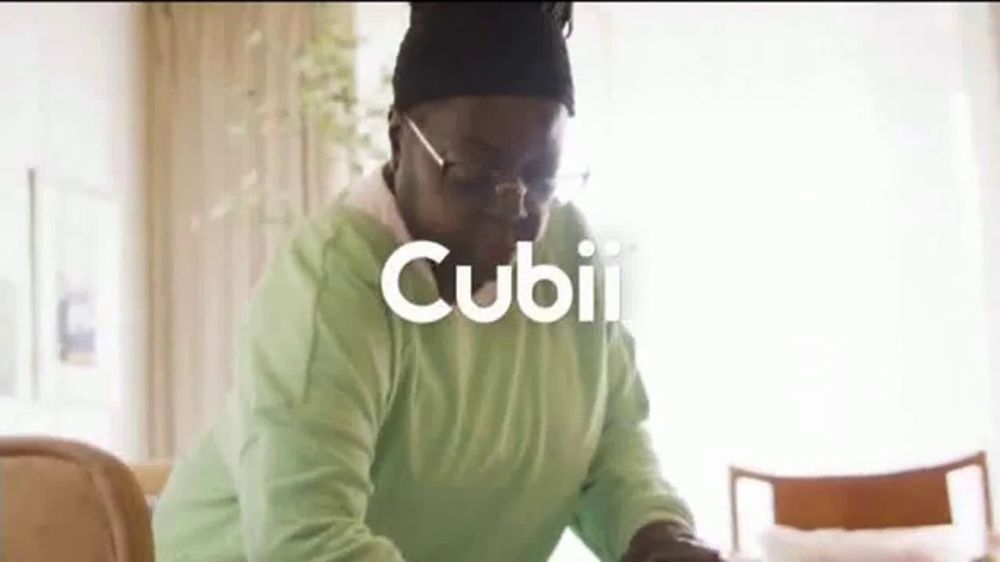
Image resolution: width=1000 pixels, height=562 pixels. I want to click on picture in frame, so click(x=73, y=256).